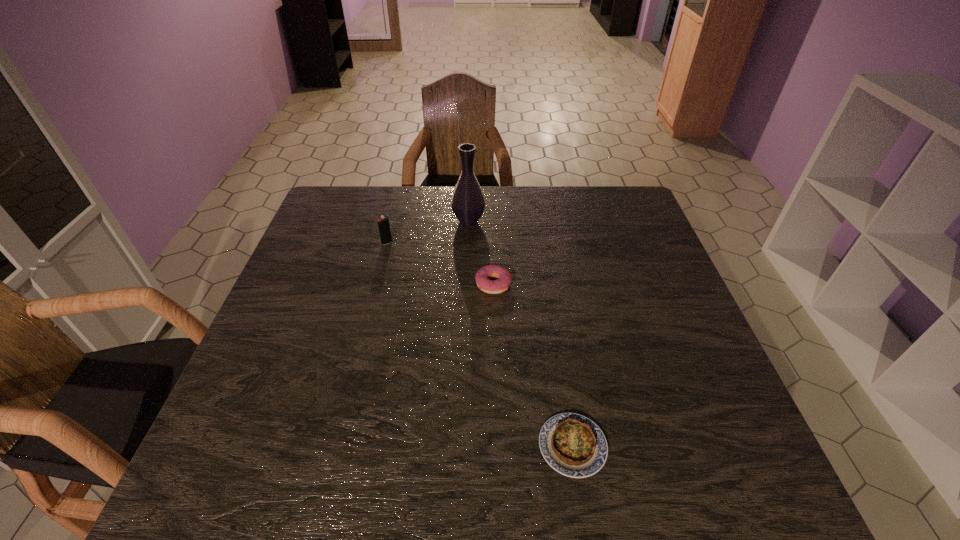
What are the coordinates of `vacant space located 0.120m on the right of the second nearest object` in the screenshot? It's located at (558, 284).

This screenshot has width=960, height=540. Find the location of `vacant space situated on the left of the quiche`. vacant space situated on the left of the quiche is located at coordinates (411, 446).

The height and width of the screenshot is (540, 960). In order to click on object situated at the far edge in this screenshot , I will do `click(468, 203)`.

The width and height of the screenshot is (960, 540). I want to click on object that is positioned at the near edge, so click(572, 444).

The height and width of the screenshot is (540, 960). What are the coordinates of `free space at the far edge` in the screenshot? It's located at (415, 219).

Locate an element on the screen. Image resolution: width=960 pixels, height=540 pixels. vacant space at the left edge of the desktop is located at coordinates (272, 339).

In the image, there is a desktop. Identify the location of vacant space at the right edge. (651, 239).

This screenshot has height=540, width=960. What are the coordinates of `free space at the far left corner of the desktop` in the screenshot? It's located at (354, 205).

The width and height of the screenshot is (960, 540). In the image, there is a desktop. Find the location of `free space at the far right corner`. free space at the far right corner is located at coordinates (627, 211).

At what (x,y) coordinates should I click in order to perform the action: click on vacant region at the near right corner of the desktop. Please return your answer as a coordinate pair (x, y). This screenshot has width=960, height=540. Looking at the image, I should click on (679, 475).